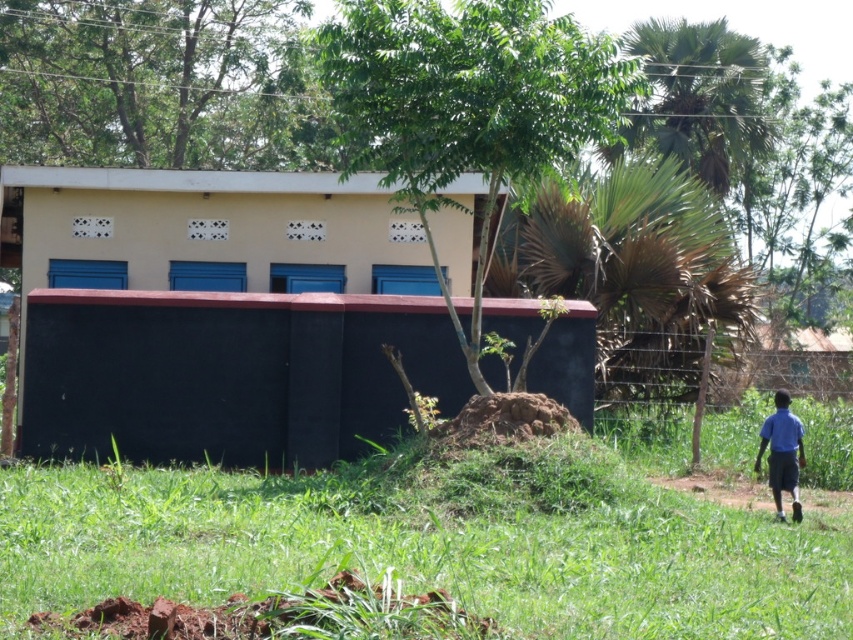
You are a gardener who needs to plant a new tree in the lower right area of the scene. Considering the yellow matte building at center and the green grassy at lower right, which area is more elevated? Please explain based on their positions.

The yellow matte building at center is positioned over the green grassy at lower right, meaning the building is elevated higher than the grassy area. Therefore, the area near the building is more elevated, so planting the tree in the lower right grassy area would be on lower ground.

You are a painter standing in front of the yellow matte building at center and the blue fabric shirt at right. You need to paint both objects. Which object should you paint first if you want to start with the taller one?

The blue fabric shirt at right is taller than the yellow matte building at center, so you should paint the blue fabric shirt at right first.

You are a gardener standing in the green grassy at lower right and want to reach the yellow matte building at center. What direction should you move to get there?

Since the green grassy at lower right is behind the yellow matte building at center, you should move forward towards the yellow matte building at center to reach it.